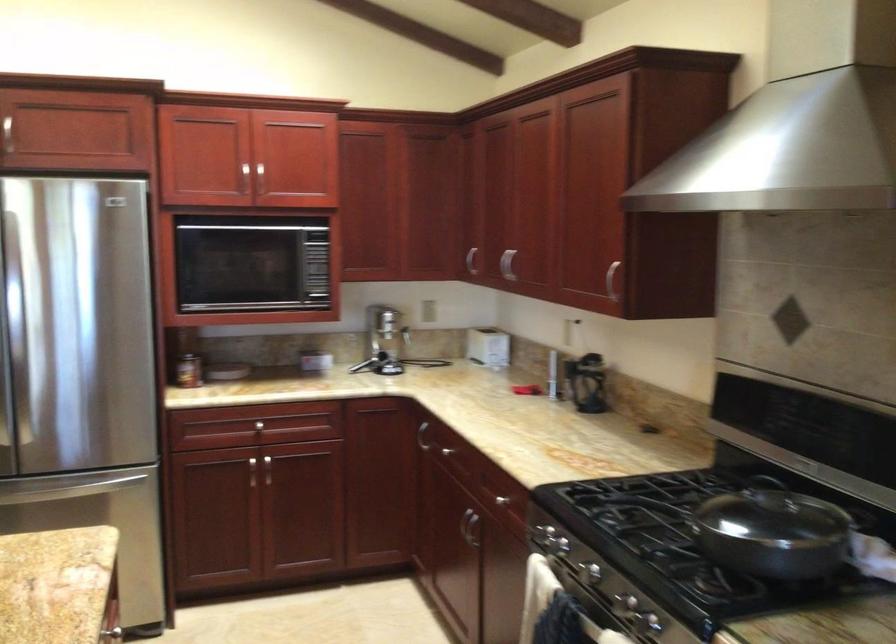
Find where to lift the black pot lid handle. Please return your answer as a coordinate pair (x, y).

(800, 545)